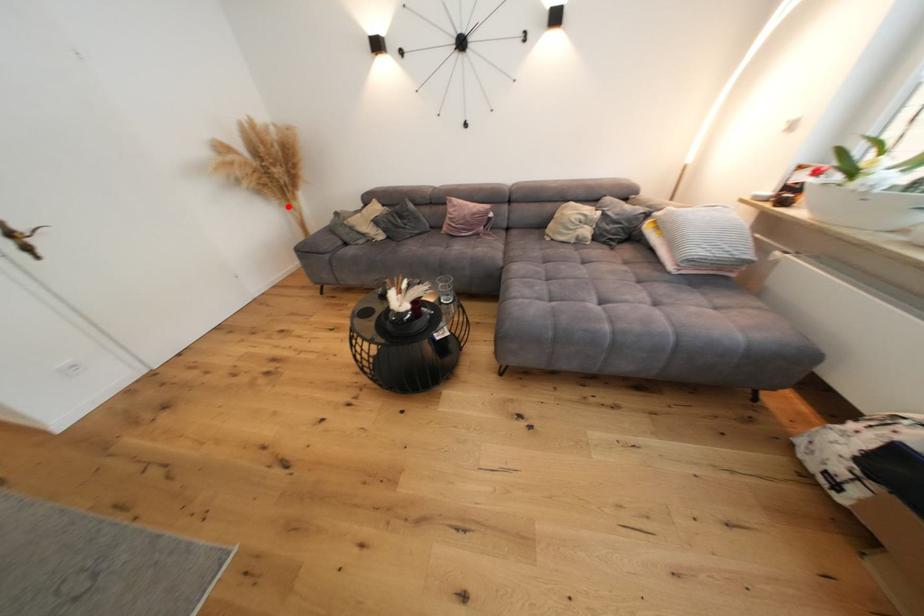
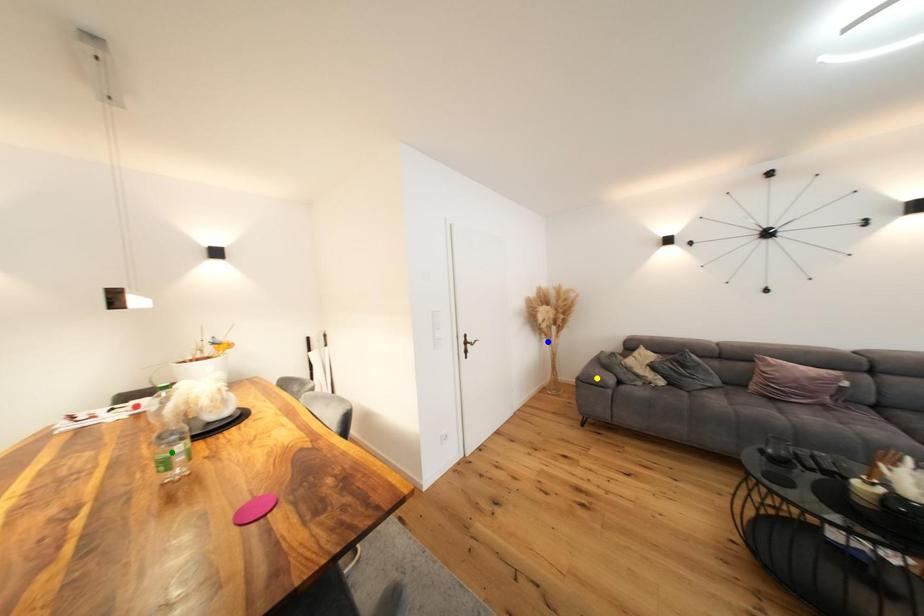
Question: I am providing you with two images of the same scene from different viewpoints. A red point is marked on the first image. You are given multiple points on the second image. In image 2, which mark is for the same physical point as the one in image 1?

Choices:
 (A) green point
 (B) blue point
 (C) yellow point

Answer: (B)